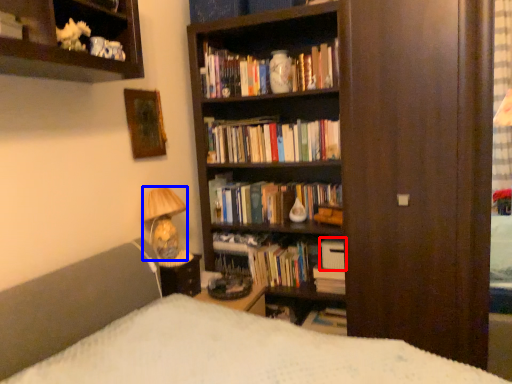
Question: Which of the following is the closest to the observer, book (highlighted by a red box) or lamp (highlighted by a blue box)?

Choices:
 (A) book
 (B) lamp

Answer: (B)